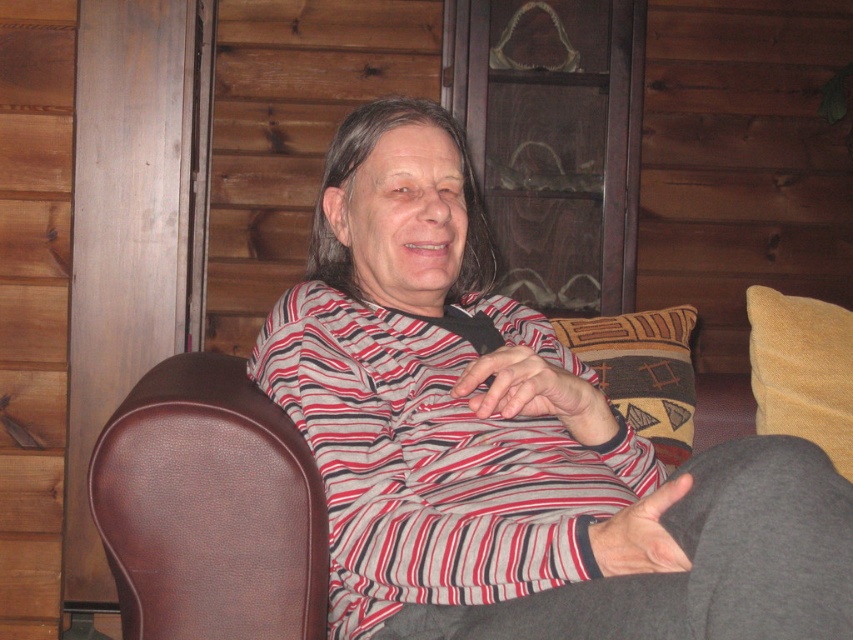
You are a person sitting in a brown leather armchair and want to place a book on the yellow soft cushion at right. Can you reach it from your current position?

The yellow soft cushion at right is located at point (802, 371), so yes, you can reach it from your current position in the brown leather armchair.

You are designing a layout for a virtual reality game and need to place a new object at point (512, 440). What object is already present at that location?

The striped fabric shirt at center is located at point (512, 440).